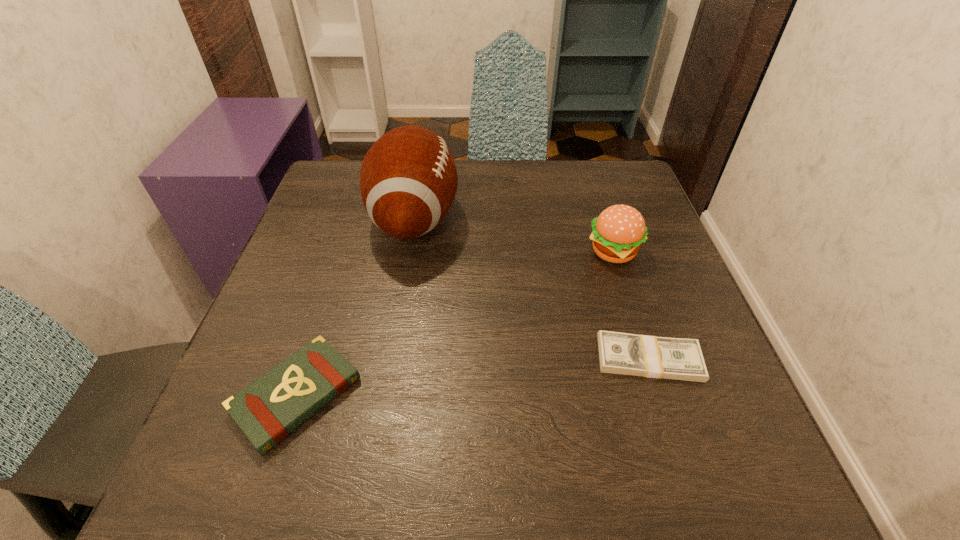
Where is `football that is at the left edge`? The width and height of the screenshot is (960, 540). football that is at the left edge is located at coordinates (408, 180).

Identify the location of book situated at the left edge. (267, 410).

The width and height of the screenshot is (960, 540). I want to click on hamburger located in the right edge section of the desktop, so [617, 233].

The width and height of the screenshot is (960, 540). In order to click on dollar that is at the right edge in this screenshot , I will do `click(619, 353)`.

In order to click on object at the far left corner in this screenshot , I will do click(x=408, y=180).

This screenshot has width=960, height=540. I want to click on object that is at the near left corner, so click(267, 410).

What are the coordinates of `vacant space at the far edge of the desktop` in the screenshot? It's located at (523, 160).

Where is `free location at the near edge of the desktop`? This screenshot has height=540, width=960. free location at the near edge of the desktop is located at coordinates click(x=515, y=454).

In the image, there is a desktop. At what (x,y) coordinates should I click in order to perform the action: click on vacant space at the left edge. Please return your answer as a coordinate pair (x, y). Looking at the image, I should click on (351, 215).

Where is `vacant space at the right edge`? vacant space at the right edge is located at coordinates (718, 434).